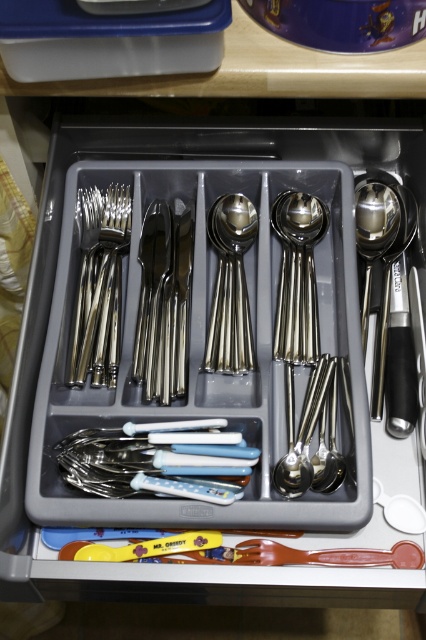
Question: Which point appears closest to the camera in this image?

Choices:
 (A) (226, 246)
 (B) (362, 300)
 (C) (161, 445)

Answer: (C)

Question: Does white plastic forks at center appear on the left side of satin silver spoon at right?

Choices:
 (A) yes
 (B) no

Answer: (A)

Question: Can you confirm if white plastic forks at center is positioned above satin silver forks at left?

Choices:
 (A) no
 (B) yes

Answer: (A)

Question: Which point appears closest to the camera in this image?

Choices:
 (A) (365, 348)
 (B) (94, 336)

Answer: (B)

Question: Which point is farther to the camera?

Choices:
 (A) (115, 328)
 (B) (227, 465)
 (C) (221, 314)
 (D) (363, 288)

Answer: (D)

Question: Does satin silver forks at left appear under satin silver spoon at center?

Choices:
 (A) no
 (B) yes

Answer: (B)